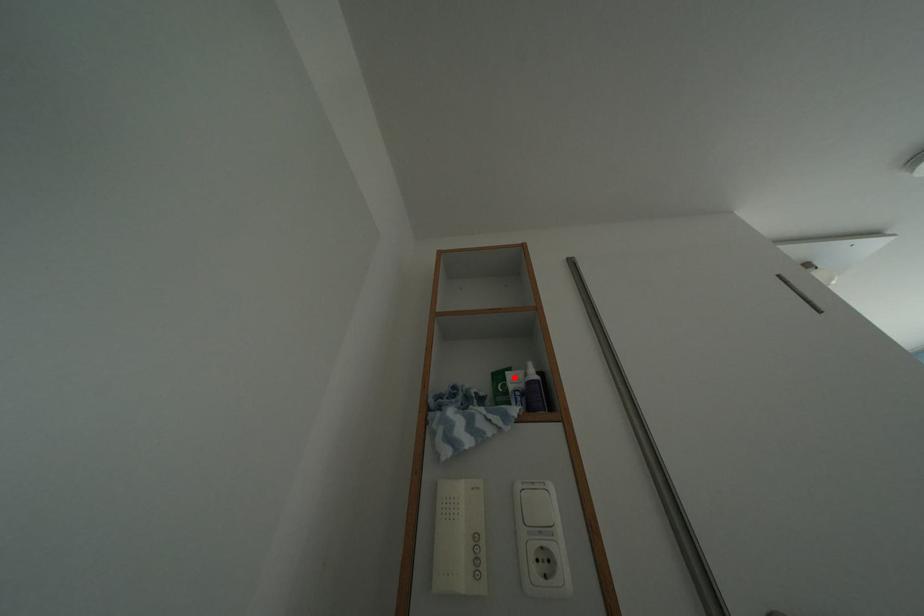
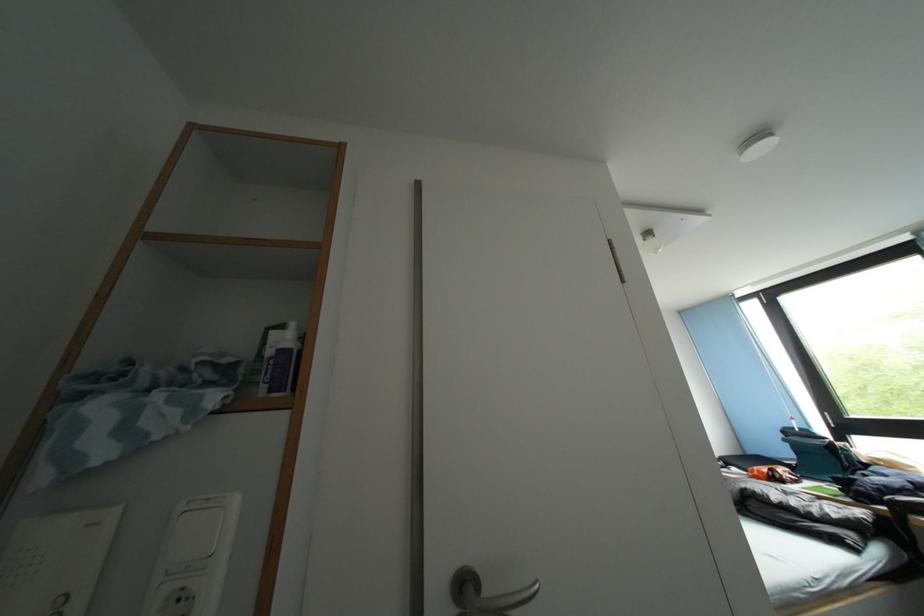
Find the pixel in the second image that matches the highlighted location in the first image.

(280, 337)